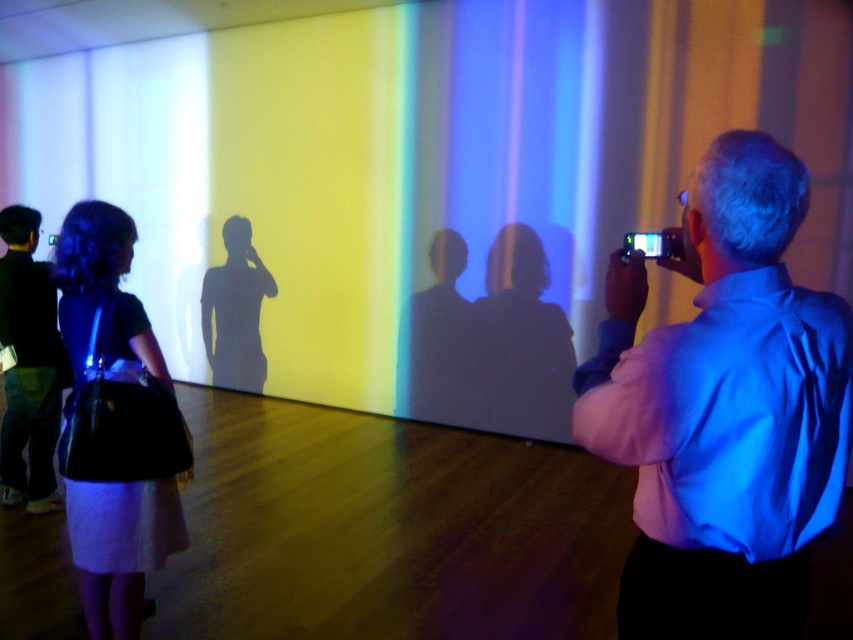
Does blue satin shirt at right appear under dark blue jeans at lower left?

Actually, blue satin shirt at right is above dark blue jeans at lower left.

Can you confirm if blue satin shirt at right is smaller than dark blue jeans at lower left?

Yes.

Image resolution: width=853 pixels, height=640 pixels. I want to click on blue satin shirt at right, so click(x=724, y=410).

Which of these two, matte black dress at left or dark blue jeans at lower left, stands taller?

With more height is dark blue jeans at lower left.

Is matte black dress at left above dark blue jeans at lower left?

No.

This screenshot has width=853, height=640. In order to click on matte black dress at left in this screenshot , I will do `click(114, 424)`.

Can you confirm if blue satin shirt at right is shorter than matte black dress at left?

Yes, blue satin shirt at right is shorter than matte black dress at left.

Is blue satin shirt at right to the left of matte black dress at left from the viewer's perspective?

No, blue satin shirt at right is not to the left of matte black dress at left.

Between point (770, 604) and point (120, 596), which one is positioned behind?

Point (120, 596)

At what (x,y) coordinates should I click in order to perform the action: click on blue satin shirt at right. Please return your answer as a coordinate pair (x, y). Looking at the image, I should click on (724, 410).